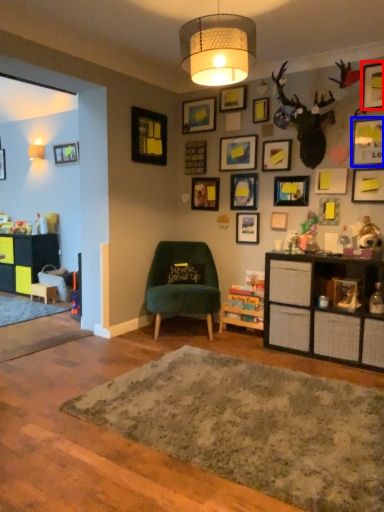
Question: Among these objects, which one is nearest to the camera, picture frame (highlighted by a red box) or picture frame (highlighted by a blue box)?

Choices:
 (A) picture frame
 (B) picture frame

Answer: (B)